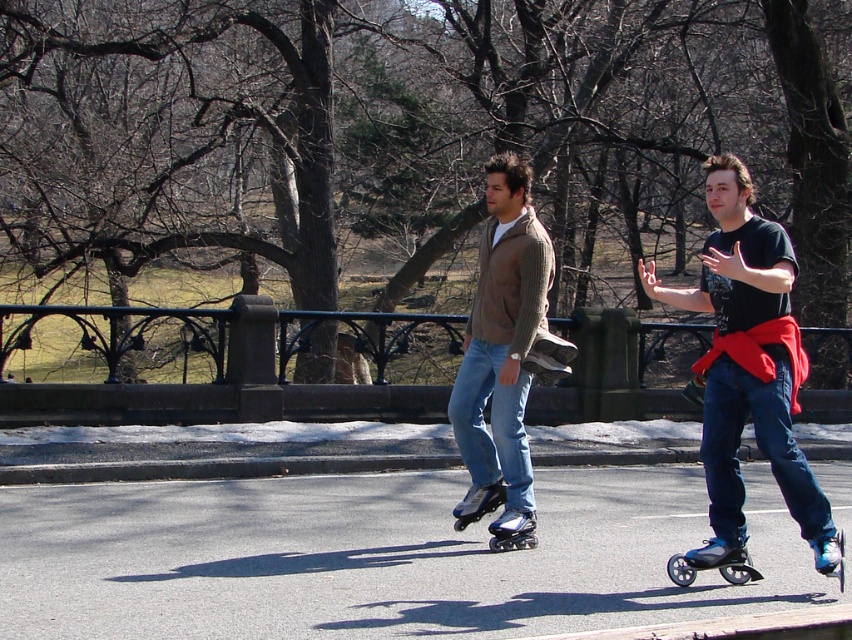
Question: Among these objects, which one is farthest from the camera?

Choices:
 (A) knit sweater at center
 (B) shiny blue roller skate at lower right
 (C) black matte roller skate at lower right

Answer: (A)

Question: Among these objects, which one is nearest to the camera?

Choices:
 (A) shiny blue roller skate at lower right
 (B) knit sweater at center
 (C) black matte roller skate at lower right

Answer: (A)

Question: Can you confirm if knit sweater at center is positioned above black matte roller skate at lower right?

Choices:
 (A) yes
 (B) no

Answer: (A)

Question: Does black matte roller skate at lower right lie behind shiny blue roller skate at lower right?

Choices:
 (A) no
 (B) yes

Answer: (B)

Question: Where is knit sweater at center located in relation to black matte roller skate at lower right in the image?

Choices:
 (A) below
 (B) above

Answer: (B)

Question: Estimate the real-world distances between objects in this image. Which object is farther from the black matte roller skate at lower right?

Choices:
 (A) knit sweater at center
 (B) shiny black roller skate at center
 (C) shiny blue roller skate at lower right
 (D) shiny blue roller skate at center

Answer: (D)